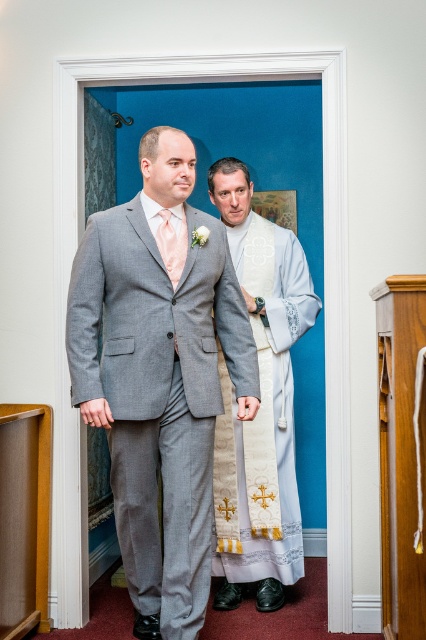
You are an event planner organizing a formal event and need to arrange the seating based on the attire of the guests. The gray wool suit at center and the peach satin tie at center are part of the same outfit. Which part of the outfit is positioned lower on the person?

The gray wool suit at center is located below the peach satin tie at center, so the gray wool suit at center is positioned lower on the person.

You are standing in the church and want to approach the point marked at coordinates point (95,244). If you can move forward at a speed of 3 feet per second, how many seconds will it take you to reach that point?

The distance between you and point (95,244) is 8.44 feet. Moving at 3 feet per second, it will take approximately 2.81 seconds to reach the point.

You are a photographer positioned at the camera. You need to capture a closeup shot of the gray wool suit at center. The camera can focus on objects within 2 meters. Can you take the photo without moving closer?

The gray wool suit at center is 2.49 meters away from camera. Since the camera can focus within 2 meters, the distance is too far to capture a closeup without moving closer.